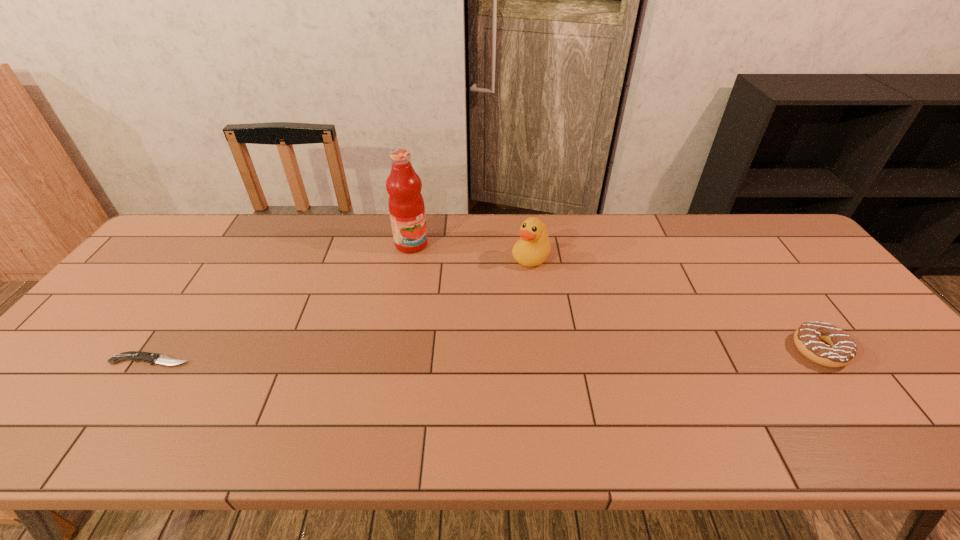
This screenshot has height=540, width=960. Identify the location of free spot located on the front label of the tallest object. (469, 283).

Locate an element on the screen. The width and height of the screenshot is (960, 540). vacant region located on the front label of the tallest object is located at coordinates (433, 259).

In order to click on vacant point located on the front label of the tallest object in this screenshot , I will do `click(479, 289)`.

Identify the location of blank area located 0.150m at the beak of the third shortest object. (496, 299).

Identify the location of blank space located 0.350m at the beak of the third shortest object. (456, 347).

You are a GUI agent. You are given a task and a screenshot of the screen. Output one action in this format:
    pyautogui.click(x=<x>, y=<y>)
    Task: Click on the vacant region located 0.190m at the beak of the third shortest object
    
    Given the screenshot: What is the action you would take?
    pyautogui.click(x=489, y=308)

Locate an element on the screen. The width and height of the screenshot is (960, 540). fruit juice that is at the far edge is located at coordinates (406, 205).

The image size is (960, 540). In order to click on duck located at the far edge in this screenshot , I will do `click(533, 248)`.

Find the location of a particular element. The width and height of the screenshot is (960, 540). object that is positioned at the left edge is located at coordinates (152, 358).

What are the coordinates of `object that is at the right edge` in the screenshot? It's located at (822, 343).